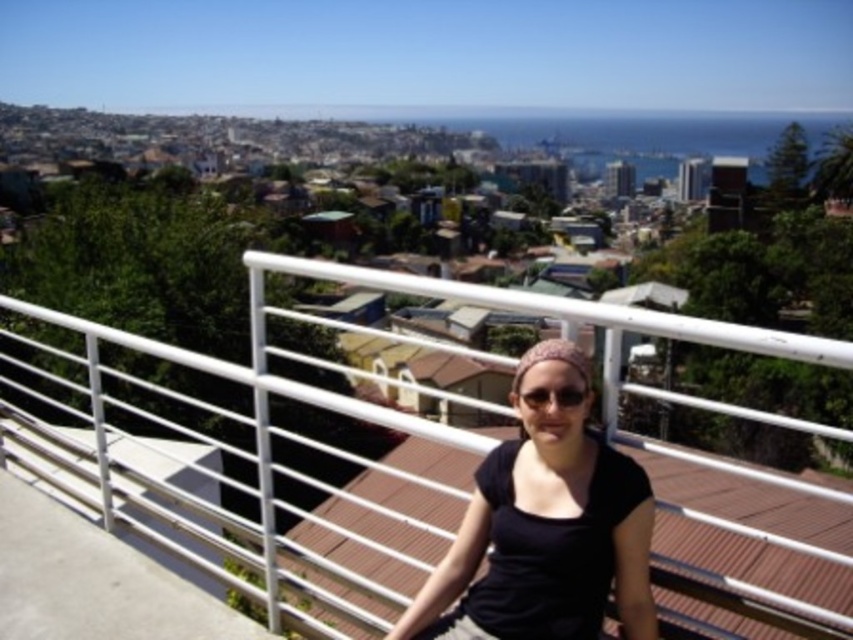
Which of these two, black matte shirt at center or black plastic sunglasses at center, stands taller?

black matte shirt at center is taller.

The width and height of the screenshot is (853, 640). Describe the element at coordinates (544, 529) in the screenshot. I see `black matte shirt at center` at that location.

Measure the distance between point (521, 372) and camera.

A distance of 34.22 meters exists between point (521, 372) and camera.

Where is `black matte shirt at center`? The image size is (853, 640). black matte shirt at center is located at coordinates (544, 529).

Is white metal railing at center to the right of black plastic sunglasses at center from the viewer's perspective?

Incorrect, white metal railing at center is not on the right side of black plastic sunglasses at center.

Based on the photo, does white metal railing at center appear under black plastic sunglasses at center?

Yes, white metal railing at center is below black plastic sunglasses at center.

Who is more forward, (x=727, y=328) or (x=537, y=387)?

Positioned in front is point (x=727, y=328).

Locate an element on the screen. Image resolution: width=853 pixels, height=640 pixels. white metal railing at center is located at coordinates (454, 298).

Can you confirm if black matte shirt at center is taller than white metal railing at center?

No.

Between black matte shirt at center and white metal railing at center, which one has less height?

Standing shorter between the two is black matte shirt at center.

Is point (648, 490) positioned before point (646, 326)?

No, it is not.

I want to click on black matte shirt at center, so click(544, 529).